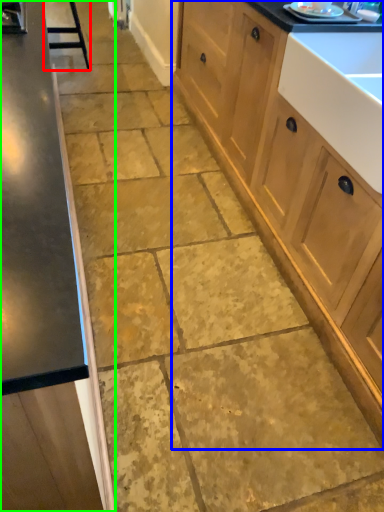
Question: Which object is positioned closest to bar stool (highlighted by a red box)? Select from cabinetry (highlighted by a blue box) and cabinetry (highlighted by a green box).

Choices:
 (A) cabinetry
 (B) cabinetry

Answer: (A)